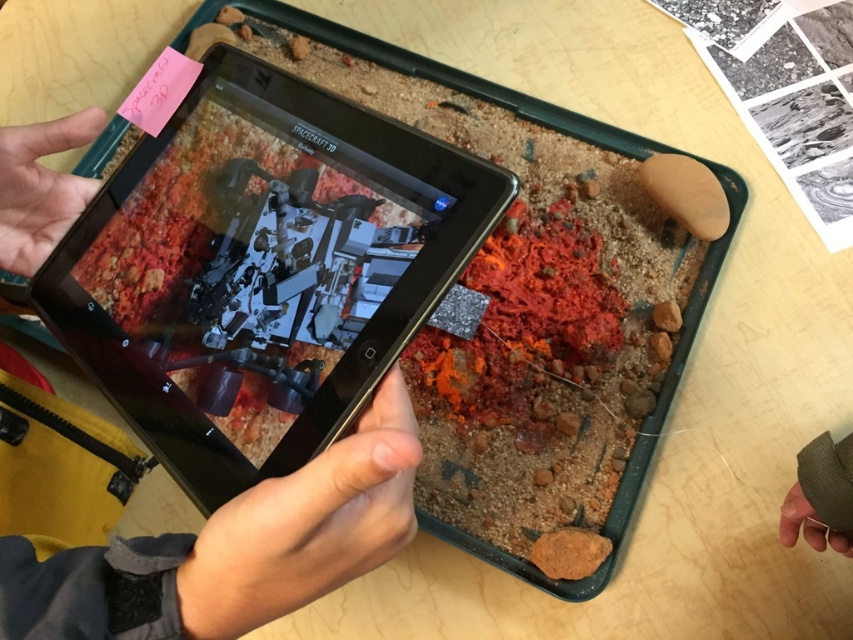
You are an astronaut preparing for a Mars mission. You have a black glossy tablet at center and a textured gray glove at lower right on your workstation. You need to place the glove closer to the tablet so that the distance between them is exactly 12 inches. How much closer do you need to move the glove to achieve this?

The current distance between the black glossy tablet at center and the textured gray glove at lower right is 16.75 inches. To reduce the distance to 12 inches, you need to move the glove closer by 4.75 inches.

You are an astronaut preparing for a Mars mission. You have a black glossy tablet at center and a textured gray glove at lower right. Which object is closer to your left hand?

The black glossy tablet at center is positioned on the left side of the textured gray glove at lower right, so the black glossy tablet at center is closer to your left hand.

You are an astronaut training to land a spacecraft on Mars. You have a black glossy tablet at center and a matte black tablet at center. Which one is above the other?

The black glossy tablet at center is positioned over matte black tablet at center.